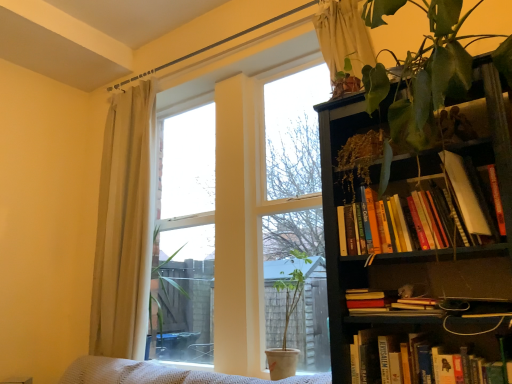
Question: Is hardcover book at lower right, arranged as the first book when ordered from the bottom, wider or thinner than white sheer curtain at upper center, which is the 1th curtain from right to left?

Choices:
 (A) wide
 (B) thin

Answer: (A)

Question: Is hardcover book at lower right, arranged as the first book when ordered from the bottom, in front of or behind white sheer curtain at upper center, which ranks as the first curtain in front-to-back order, in the image?

Choices:
 (A) behind
 (B) front

Answer: (B)

Question: Estimate the real-world distances between objects in this image. Which object is closer to the green leafy plant at upper right?

Choices:
 (A) transparent glass window at center
 (B) hardcover books at upper right, arranged as the 1th book when viewed from the top
 (C) white sheer curtain at upper center, the 2th curtain when ordered from back to front
 (D) hardcover book at lower right, arranged as the first book when ordered from the bottom
 (E) matte white pot at center

Answer: (B)

Question: Which object is the farthest from the dark wood bookcase at right?

Choices:
 (A) matte white pot at center
 (B) beige fabric curtain at left, positioned as the 1th curtain in back-to-front order
 (C) hardcover book at lower right, arranged as the first book when ordered from the bottom
 (D) transparent glass window at center
 (E) green leafy plant at upper right

Answer: (B)